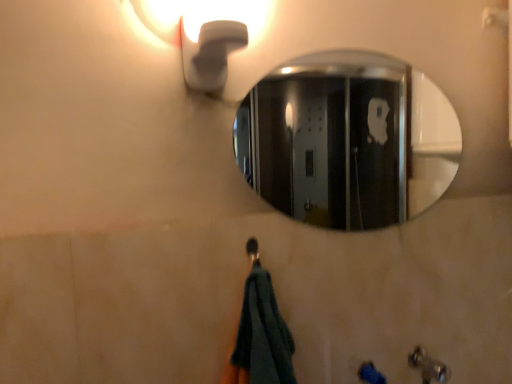
Question: Is metallic silver faucet at lower right further to camera compared to polished chrome mirror at upper center?

Choices:
 (A) yes
 (B) no

Answer: (B)

Question: Is polished chrome mirror at upper center surrounded by metallic silver faucet at lower right?

Choices:
 (A) no
 (B) yes

Answer: (A)

Question: Considering the relative sizes of metallic silver faucet at lower right and polished chrome mirror at upper center in the image provided, is metallic silver faucet at lower right taller than polished chrome mirror at upper center?

Choices:
 (A) no
 (B) yes

Answer: (A)

Question: From the image's perspective, does metallic silver faucet at lower right appear higher than polished chrome mirror at upper center?

Choices:
 (A) yes
 (B) no

Answer: (B)

Question: Is metallic silver faucet at lower right positioned beyond the bounds of polished chrome mirror at upper center?

Choices:
 (A) no
 (B) yes

Answer: (B)

Question: Is white matte light fixture at upper left bigger or smaller than polished chrome mirror at upper center?

Choices:
 (A) big
 (B) small

Answer: (A)

Question: Is point (151, 23) positioned closer to the camera than point (254, 163)?

Choices:
 (A) farther
 (B) closer

Answer: (B)

Question: From their relative heights in the image, would you say white matte light fixture at upper left is taller or shorter than polished chrome mirror at upper center?

Choices:
 (A) tall
 (B) short

Answer: (B)

Question: Would you say white matte light fixture at upper left is to the left or to the right of polished chrome mirror at upper center in the picture?

Choices:
 (A) right
 (B) left

Answer: (B)

Question: Looking at the image, does metallic silver faucet at lower right seem bigger or smaller compared to white matte light fixture at upper left?

Choices:
 (A) big
 (B) small

Answer: (B)

Question: From the image's perspective, is metallic silver faucet at lower right located above or below white matte light fixture at upper left?

Choices:
 (A) below
 (B) above

Answer: (A)

Question: Considering the positions of point (432, 369) and point (198, 0), is point (432, 369) closer or farther from the camera than point (198, 0)?

Choices:
 (A) closer
 (B) farther

Answer: (B)

Question: In terms of width, does metallic silver faucet at lower right look wider or thinner when compared to white matte light fixture at upper left?

Choices:
 (A) wide
 (B) thin

Answer: (A)

Question: Would you say white matte light fixture at upper left is inside or outside metallic silver faucet at lower right?

Choices:
 (A) inside
 (B) outside

Answer: (B)

Question: Considering the positions of white matte light fixture at upper left and metallic silver faucet at lower right in the image, is white matte light fixture at upper left wider or thinner than metallic silver faucet at lower right?

Choices:
 (A) wide
 (B) thin

Answer: (B)